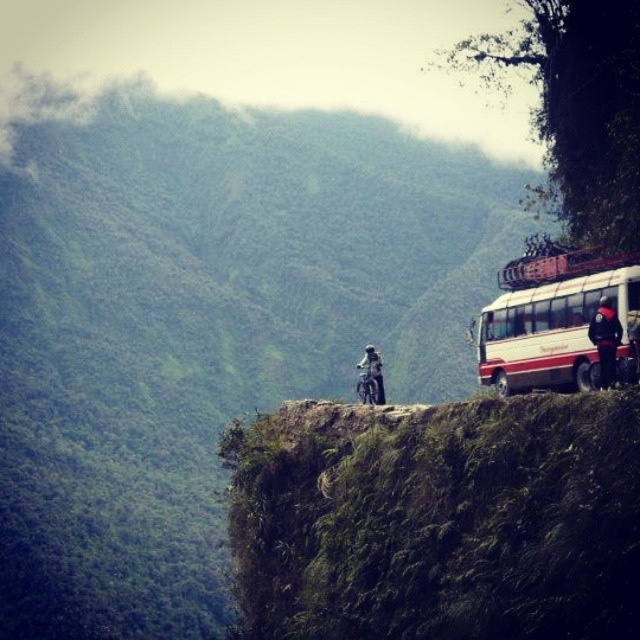
You are a hiker planning to walk from the green grassy cliff at upper right to the dark gray fabric jacket at center. Which direction should you move to reach the jacket?

To reach the dark gray fabric jacket at center from the green grassy cliff at upper right, you should move to the right since the cliff is to the left of the jacket.